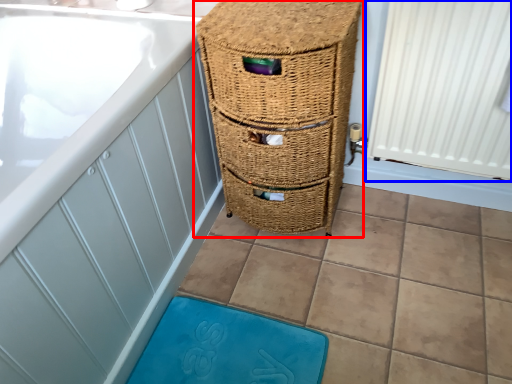
Question: Among these objects, which one is farthest to the camera, furniture (highlighted by a red box) or radiator (highlighted by a blue box)?

Choices:
 (A) furniture
 (B) radiator

Answer: (A)